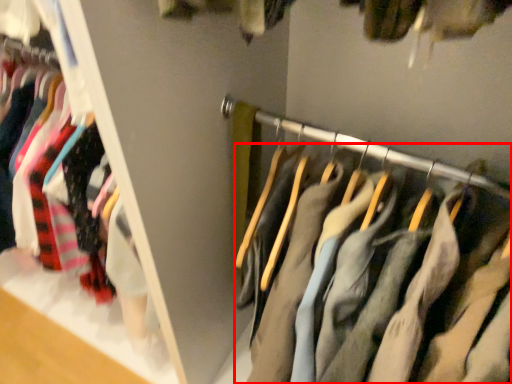
Question: From the image's perspective, what is the correct spatial positioning of trousers (annotated by the red box) in reference to closet?

Choices:
 (A) above
 (B) below

Answer: (B)